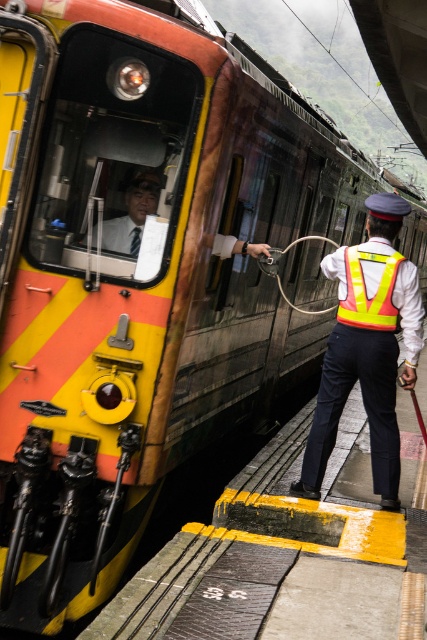
You are standing at the point marked as point (365, 291) in the train station scene. Which object is exactly at your current position?

The yellow reflective safety vest at center is exactly at point (365, 291).